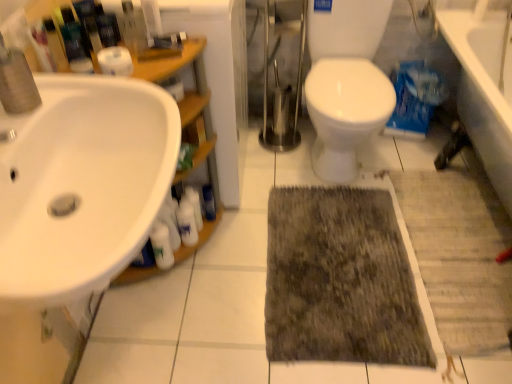
What do you see at coordinates (195, 205) in the screenshot? I see `white glossy bottle at lower left, marked as the second toiletry in a right-to-left arrangement` at bounding box center [195, 205].

Locate an element on the screen. This screenshot has width=512, height=384. dark gray shaggy rug at center is located at coordinates (340, 280).

The image size is (512, 384). In order to click on white glossy bottle at center, positioned as the 2th toiletry in left-to-right order in this screenshot , I will do `click(209, 202)`.

In order to face white matte toilet paper at upper left, should I rotate leftwards or rightwards?

To align with it, rotate left about 18.003°.

The height and width of the screenshot is (384, 512). Describe the element at coordinates (162, 246) in the screenshot. I see `white glossy bottle at lower left, which is the first cleaning product from left to right` at that location.

This screenshot has height=384, width=512. Find the location of `white glossy bottle at lower left, marked as the second toiletry in a right-to-left arrangement`. white glossy bottle at lower left, marked as the second toiletry in a right-to-left arrangement is located at coordinates (195, 205).

In terms of height, does white matte toilet paper at upper left look taller or shorter compared to white glossy bottle at lower left, marked as the second toiletry in a right-to-left arrangement?

white matte toilet paper at upper left is shorter than white glossy bottle at lower left, marked as the second toiletry in a right-to-left arrangement.

From the image's perspective, is white matte toilet paper at upper left located above or below white glossy bottle at lower left, positioned as the 1th toiletry in left-to-right order?

white matte toilet paper at upper left is situated higher than white glossy bottle at lower left, positioned as the 1th toiletry in left-to-right order, in the image.

Between white matte toilet paper at upper left and white glossy bottle at lower left, positioned as the 1th toiletry in left-to-right order, which one is positioned in front?

Positioned in front is white matte toilet paper at upper left.

Can you tell me how much white matte toilet paper at upper left and white glossy bottle at lower left, marked as the second toiletry in a right-to-left arrangement, differ in facing direction?

40 degrees separate the facing orientations of white matte toilet paper at upper left and white glossy bottle at lower left, marked as the second toiletry in a right-to-left arrangement.

Is point (48, 188) farther from viewer compared to point (192, 211)?

No, it is not.

What's the angular difference between white glossy sink at left and white glossy bottle at lower left, which appears as the second cleaning product when viewed from the left,'s facing directions?

35.9 degrees.

From the image's perspective, is white glossy sink at left located above or below white glossy bottle at lower left, acting as the 1th cleaning product starting from the right?

white glossy sink at left is above white glossy bottle at lower left, acting as the 1th cleaning product starting from the right.

Is white glossy sink at left at the right side of white glossy bottle at lower left, acting as the 1th cleaning product starting from the right?

Incorrect, white glossy sink at left is not on the right side of white glossy bottle at lower left, acting as the 1th cleaning product starting from the right.

Which is closer, (212, 210) or (368, 278)?

The point (368, 278) is closer to the camera.

Is white glossy bottle at center, positioned as the 2th toiletry in left-to-right order, taller than dark gray shaggy rug at center?

Yes.

Could you tell me if white glossy bottle at center, which is the 1th toiletry in right-to-left order, is facing dark gray shaggy rug at center?

No, white glossy bottle at center, which is the 1th toiletry in right-to-left order, is not facing towards dark gray shaggy rug at center.

In the scene shown: Which is more to the left, white glossy bottle at center, which is the 1th toiletry in right-to-left order, or dark gray shaggy rug at center?

From the viewer's perspective, white glossy bottle at center, which is the 1th toiletry in right-to-left order, appears more on the left side.

From the image's perspective, is white glossy bottle at lower left, acting as the 1th cleaning product starting from the right, below white glossy bottle at lower left, which is the first cleaning product from left to right?

No, from the image's perspective, white glossy bottle at lower left, acting as the 1th cleaning product starting from the right, is not below white glossy bottle at lower left, which is the first cleaning product from left to right.

Does white glossy bottle at lower left, acting as the 1th cleaning product starting from the right, lie in front of white glossy bottle at lower left, which is the first cleaning product from left to right?

No, white glossy bottle at lower left, acting as the 1th cleaning product starting from the right, is behind white glossy bottle at lower left, which is the first cleaning product from left to right.

Is white glossy bottle at lower left, which appears as the second cleaning product when viewed from the left, smaller than white glossy bottle at lower left, which is the first cleaning product from left to right?

Actually, white glossy bottle at lower left, which appears as the second cleaning product when viewed from the left, might be larger than white glossy bottle at lower left, which is the first cleaning product from left to right.

Which of these two, white glossy bottle at lower left, acting as the 1th cleaning product starting from the right, or white glossy bottle at lower left, which is the first cleaning product from left to right, is thinner?

With smaller width is white glossy bottle at lower left, which is the first cleaning product from left to right.

Image resolution: width=512 pixels, height=384 pixels. I want to click on sink above the dark gray shaggy rug at center (from the image's perspective), so [x=81, y=184].

Does point (91, 155) appear closer or farther from the camera than point (386, 217)?

Point (91, 155) appears to be closer to the viewer than point (386, 217).

Is white glossy sink at left situated inside dark gray shaggy rug at center or outside?

white glossy sink at left cannot be found inside dark gray shaggy rug at center.

Does white glossy sink at left have a greater width compared to dark gray shaggy rug at center?

In fact, white glossy sink at left might be narrower than dark gray shaggy rug at center.

Is white matte toilet paper at upper left inside the boundaries of white glossy bottle at lower left, which appears as the second cleaning product when viewed from the left, or outside?

white matte toilet paper at upper left lies outside white glossy bottle at lower left, which appears as the second cleaning product when viewed from the left.

Which point is more forward, (119, 58) or (186, 223)?

Point (119, 58)

From the image's perspective, is white matte toilet paper at upper left above white glossy bottle at lower left, acting as the 1th cleaning product starting from the right?

Yes, from the image's perspective, white matte toilet paper at upper left is on top of white glossy bottle at lower left, acting as the 1th cleaning product starting from the right.

Locate an element on the screen. the 1st toiletry to the right of the white glossy bottle at lower left, acting as the 1th cleaning product starting from the right, counting from the anchor's position is located at coordinates (195, 205).

Considering the sizes of objects white glossy bottle at lower left, positioned as the 1th toiletry in left-to-right order, and white glossy bottle at lower left, acting as the 1th cleaning product starting from the right, in the image provided, who is wider, white glossy bottle at lower left, positioned as the 1th toiletry in left-to-right order, or white glossy bottle at lower left, acting as the 1th cleaning product starting from the right,?

Wider between the two is white glossy bottle at lower left, acting as the 1th cleaning product starting from the right.

Considering their positions, is white glossy bottle at lower left, marked as the second toiletry in a right-to-left arrangement, located in front of or behind white glossy bottle at lower left, which appears as the second cleaning product when viewed from the left?

white glossy bottle at lower left, marked as the second toiletry in a right-to-left arrangement, is positioned farther from the viewer than white glossy bottle at lower left, which appears as the second cleaning product when viewed from the left.

Is white glossy bottle at lower left, positioned as the 1th toiletry in left-to-right order, oriented away from white glossy bottle at lower left, acting as the 1th cleaning product starting from the right?

That's not correct — white glossy bottle at lower left, positioned as the 1th toiletry in left-to-right order, is not looking away from white glossy bottle at lower left, acting as the 1th cleaning product starting from the right.

From a real-world perspective, count 1st toiletrys downward from the white matte toilet paper at upper left and point to it. Please provide its 2D coordinates.

[(195, 205)]

Find the location of a particular element. This screenshot has width=512, height=384. the 2nd cleaning product behind the white glossy sink at left is located at coordinates (187, 223).

When comparing their distances from dark gray shaggy rug at center, does white glossy bottle at lower left, acting as the 1th cleaning product starting from the right, or white glossy sink at left seem further?

white glossy sink at left.

Based on their spatial positions, is white glossy sink at left or white glossy bottle at lower left, marked as the second cleaning product in a right-to-left arrangement, closer to dark gray shaggy rug at center?

white glossy bottle at lower left, marked as the second cleaning product in a right-to-left arrangement, lies closer to dark gray shaggy rug at center than the other object.

Considering their positions, is white glossy bottle at lower left, marked as the second toiletry in a right-to-left arrangement, positioned further to white glossy bottle at center, positioned as the 2th toiletry in left-to-right order, than dark gray shaggy rug at center?

Based on the image, dark gray shaggy rug at center appears to be further to white glossy bottle at center, positioned as the 2th toiletry in left-to-right order.

Considering their positions, is dark gray shaggy rug at center positioned closer to white glossy bottle at lower left, which appears as the second cleaning product when viewed from the left, than white glossy sink at left?

dark gray shaggy rug at center.

Estimate the real-world distances between objects in this image. Which object is closer to white glossy bottle at lower left, which is the first cleaning product from left to right, white glossy bottle at lower left, positioned as the 1th toiletry in left-to-right order, or dark gray shaggy rug at center?

white glossy bottle at lower left, positioned as the 1th toiletry in left-to-right order, is closer to white glossy bottle at lower left, which is the first cleaning product from left to right.

Based on their spatial positions, is white glossy bottle at lower left, which is the first cleaning product from left to right, or white glossy sink at left closer to white matte toilet paper at upper left?

Based on the image, white glossy sink at left appears to be nearer to white matte toilet paper at upper left.

Considering their positions, is white glossy bottle at lower left, which appears as the second cleaning product when viewed from the left, positioned closer to white matte toilet paper at upper left than white glossy bottle at lower left, marked as the second toiletry in a right-to-left arrangement?

white glossy bottle at lower left, marked as the second toiletry in a right-to-left arrangement, lies closer to white matte toilet paper at upper left than the other object.

Considering their positions, is white glossy bottle at center, positioned as the 2th toiletry in left-to-right order, positioned closer to white glossy sink at left than white glossy bottle at lower left, marked as the second cleaning product in a right-to-left arrangement?

white glossy bottle at lower left, marked as the second cleaning product in a right-to-left arrangement, is positioned closer to the anchor white glossy sink at left.

At what (x,y) coordinates should I click in order to perform the action: click on cleaning product between white matte toilet paper at upper left and white glossy bottle at lower left, which is the first cleaning product from left to right, in the vertical direction. Please return your answer as a coordinate pair (x, y). Looking at the image, I should click on (187, 223).

What are the coordinates of `toiletry between white glossy bottle at lower left, positioned as the 1th toiletry in left-to-right order, and dark gray shaggy rug at center, in the horizontal direction` in the screenshot? It's located at (209, 202).

I want to click on cleaning product positioned between white glossy sink at left and white glossy bottle at lower left, acting as the 1th cleaning product starting from the right, from near to far, so click(162, 246).

Locate an element on the screen. The height and width of the screenshot is (384, 512). toilet paper positioned between white glossy sink at left and white glossy bottle at lower left, which appears as the second cleaning product when viewed from the left, from near to far is located at coordinates (115, 61).